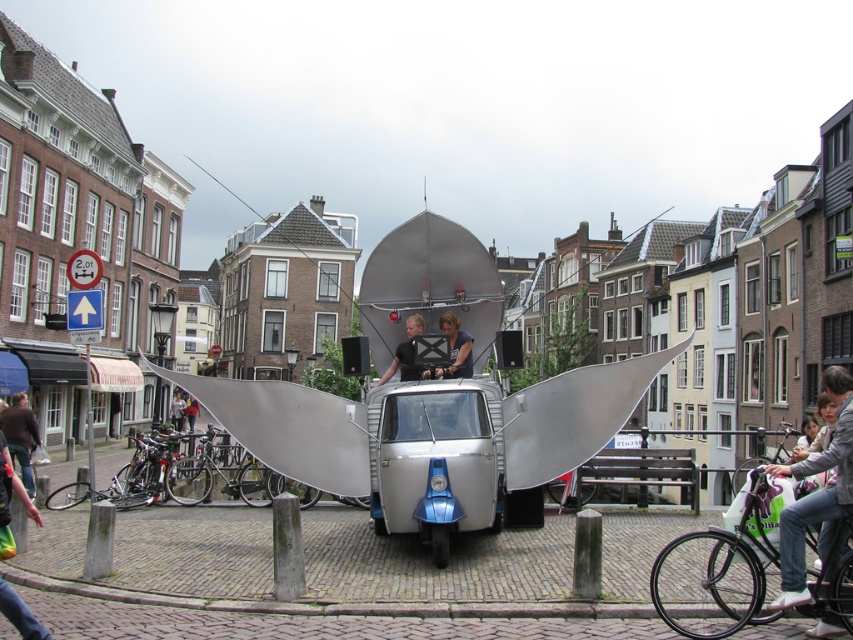
Describe the element at coordinates (12, 488) in the screenshot. The width and height of the screenshot is (853, 640). I see `brushed metal bicycle at lower left` at that location.

Which is above, brushed metal bicycle at lower left or light brown wooden chair at center?

brushed metal bicycle at lower left is above.

Is point (21, 618) farther from camera compared to point (178, 401)?

That is False.

Where is `brushed metal bicycle at lower left`? The width and height of the screenshot is (853, 640). brushed metal bicycle at lower left is located at coordinates (12, 488).

Between denim jeans at lower right and light brown wooden chair at center, which one appears on the left side from the viewer's perspective?

light brown wooden chair at center is more to the left.

Does denim jeans at lower right lie behind light brown wooden chair at center?

No.

Find the location of a particular element. The image size is (853, 640). denim jeans at lower right is located at coordinates (816, 493).

What do you see at coordinates (717, 572) in the screenshot?
I see `green matte bicycle at lower right` at bounding box center [717, 572].

Who is positioned more to the right, green matte bicycle at lower right or light brown leather jacket at center?

Positioned to the right is green matte bicycle at lower right.

Is point (724, 586) positioned behind point (190, 400)?

No, (724, 586) is closer to viewer.

Image resolution: width=853 pixels, height=640 pixels. I want to click on green matte bicycle at lower right, so click(717, 572).